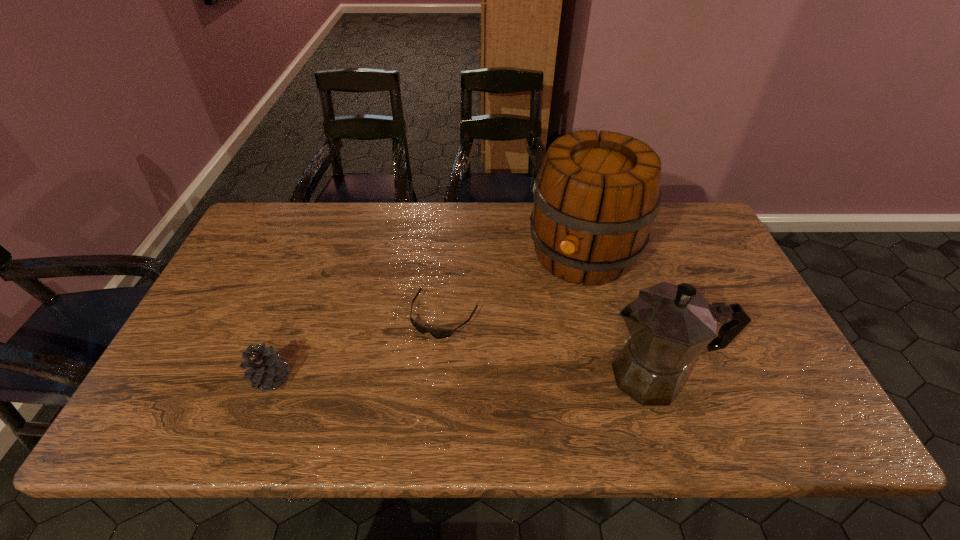
Image resolution: width=960 pixels, height=540 pixels. I want to click on the third tallest object, so click(266, 370).

Find the location of a particular element. The image size is (960, 540). pinecone is located at coordinates (266, 370).

Find the location of a particular element. Image resolution: width=960 pixels, height=540 pixels. coffeepot is located at coordinates (670, 325).

Identify the location of cider. The width and height of the screenshot is (960, 540). [595, 198].

This screenshot has height=540, width=960. I want to click on the shortest object, so click(x=437, y=334).

The height and width of the screenshot is (540, 960). Identify the location of the second object from left to right. (437, 334).

Where is `vacant region located 0.190m on the right of the second shortest object`? The height and width of the screenshot is (540, 960). vacant region located 0.190m on the right of the second shortest object is located at coordinates (372, 379).

Identify the location of vacant space located 0.180m on the pouring side of the coffeepot. The width and height of the screenshot is (960, 540). (521, 376).

You are a GUI agent. You are given a task and a screenshot of the screen. Output one action in this format:
    pyautogui.click(x=<x>, y=<y>)
    Task: Click on the vacant space located 0.130m on the pouring side of the coffeepot
    The image size is (960, 540).
    Given the screenshot: What is the action you would take?
    coord(542,376)

The image size is (960, 540). In order to click on vacant space situated 0.230m on the pouring side of the coffeepot in this screenshot , I will do `click(500, 376)`.